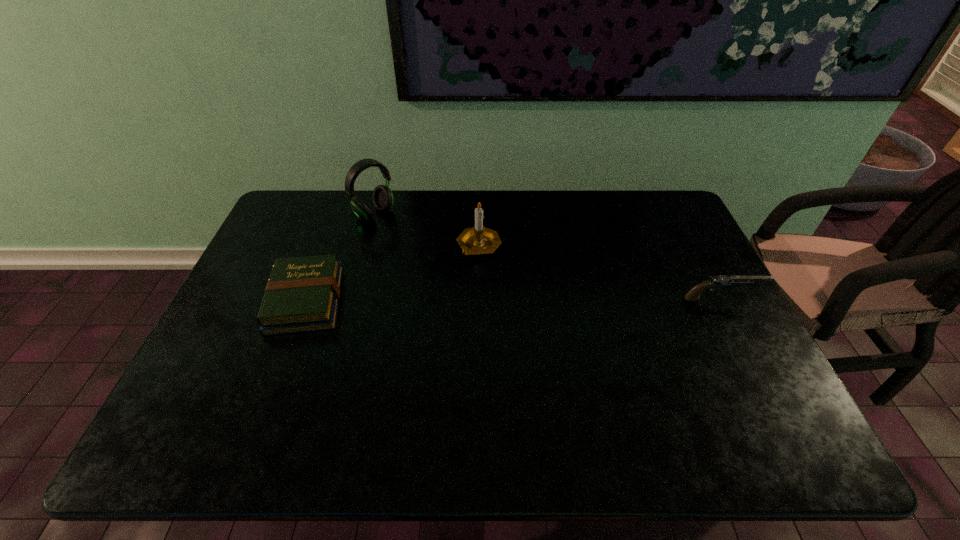
Find the location of a particular element. The height and width of the screenshot is (540, 960). vacant spot on the desktop that is between the book and the rightmost object and is positioned on the ear cups of the farthest object is located at coordinates (481, 299).

You are a GUI agent. You are given a task and a screenshot of the screen. Output one action in this format:
    pyautogui.click(x=<x>, y=<y>)
    Task: Click on the vacant space on the desktop that is between the shortest object and the third tallest object and is positioned with a handle on the second tallest object
    The image size is (960, 540).
    Given the screenshot: What is the action you would take?
    pyautogui.click(x=468, y=299)